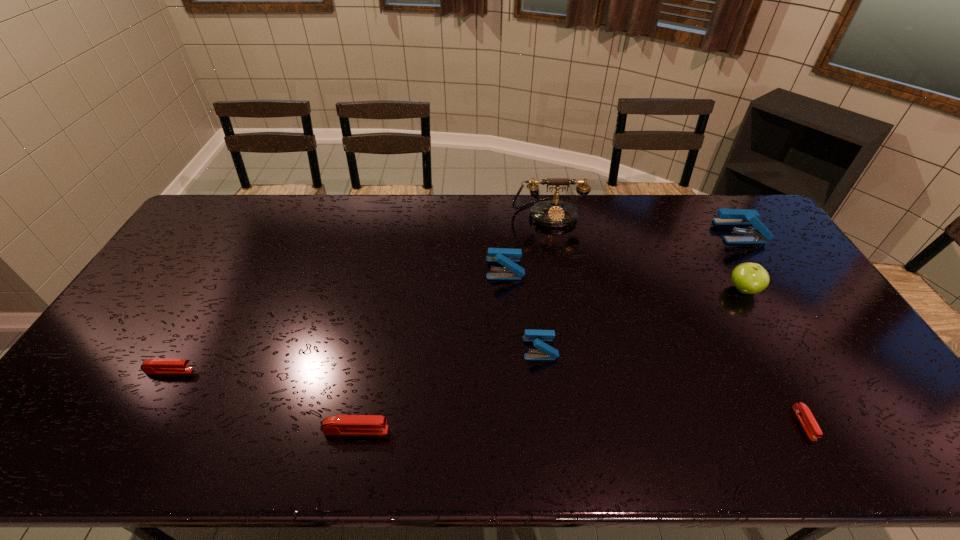
The height and width of the screenshot is (540, 960). I want to click on the third shortest stapler, so click(x=339, y=424).

Identify the location of the second shortest object. This screenshot has height=540, width=960. (151, 366).

You are a GUI agent. You are given a task and a screenshot of the screen. Output one action in this format:
    pyautogui.click(x=<x>, y=<y>)
    Task: Click on the leftmost red stapler
    The width and height of the screenshot is (960, 540).
    Given the screenshot: What is the action you would take?
    pyautogui.click(x=151, y=366)

This screenshot has width=960, height=540. I want to click on the smallest red stapler, so click(x=803, y=413).

Find the location of a particular element. The image size is (960, 540). the shortest stapler is located at coordinates (803, 413).

I want to click on blank space located on the dial of the black telephone, so [x=564, y=299].

I want to click on vacant space situated 0.110m on the back of the biggest blue stapler, so click(721, 202).

Image resolution: width=960 pixels, height=540 pixels. I want to click on free space located 0.400m on the back of the apple, so click(x=694, y=204).

Locate an element on the screen. This screenshot has height=540, width=960. blank area located on the left of the fifth shortest object is located at coordinates (440, 268).

Find the location of a particular element. vacant space situated on the back of the third farthest stapler is located at coordinates (536, 309).